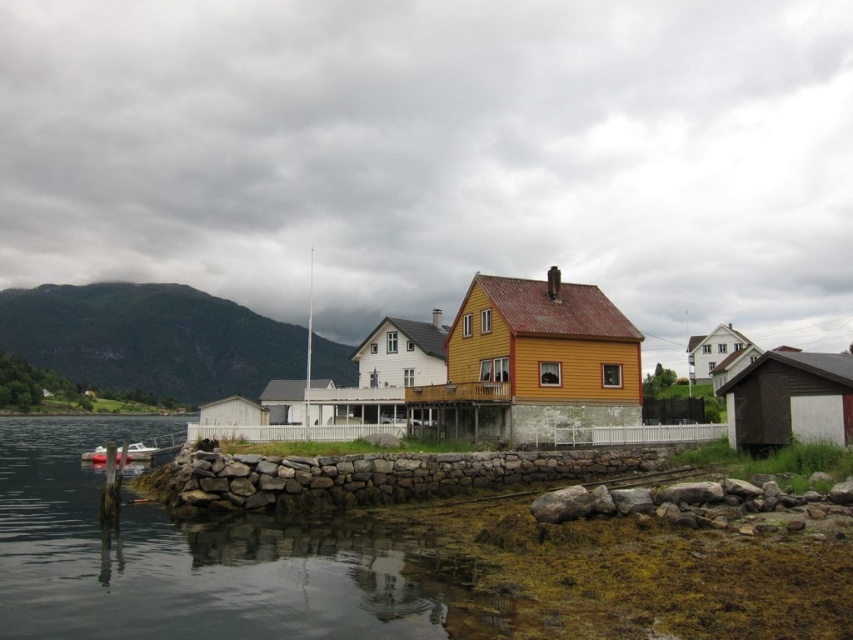
Which is more to the left, clear water at lower left or white plastic boat at lower left?

From the viewer's perspective, white plastic boat at lower left appears more on the left side.

Who is shorter, clear water at lower left or white plastic boat at lower left?

Standing shorter between the two is clear water at lower left.

Locate an element on the screen. clear water at lower left is located at coordinates (196, 561).